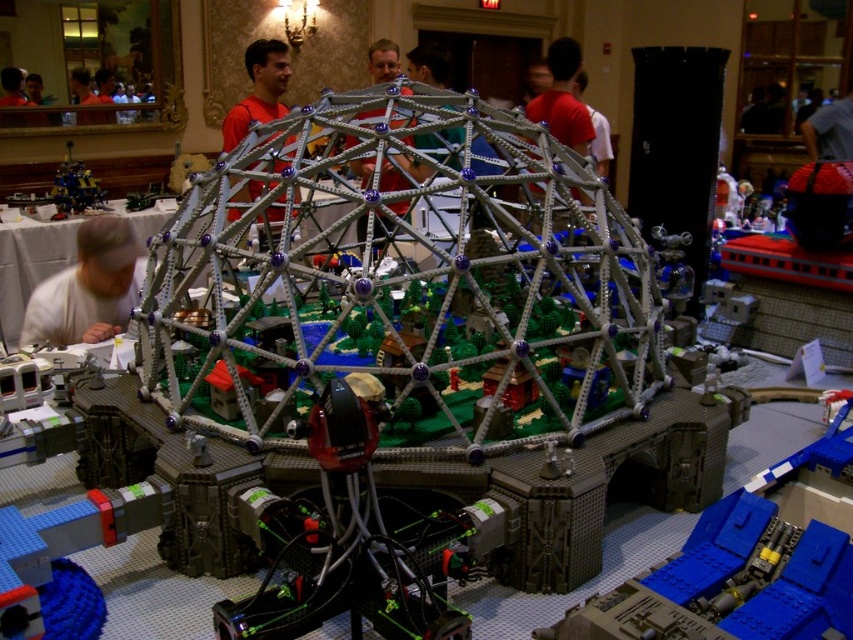
Question: Which object is farther from the camera taking this photo?

Choices:
 (A) metallic blue robot at left
 (B) orange shirt at center

Answer: (A)

Question: Which object appears closest to the camera in this image?

Choices:
 (A) orange shirt at center
 (B) white matte shirt at lower left

Answer: (B)

Question: In this image, where is orange shirt at center located relative to metallic blue robot at left?

Choices:
 (A) left
 (B) right

Answer: (B)

Question: Which is farther from the orange shirt at center?

Choices:
 (A) metallic blue robot at left
 (B) white matte shirt at lower left

Answer: (B)

Question: Where is orange shirt at center located in relation to metallic blue robot at left in the image?

Choices:
 (A) left
 (B) right

Answer: (B)

Question: Can you confirm if white matte shirt at lower left is bigger than orange shirt at center?

Choices:
 (A) yes
 (B) no

Answer: (B)